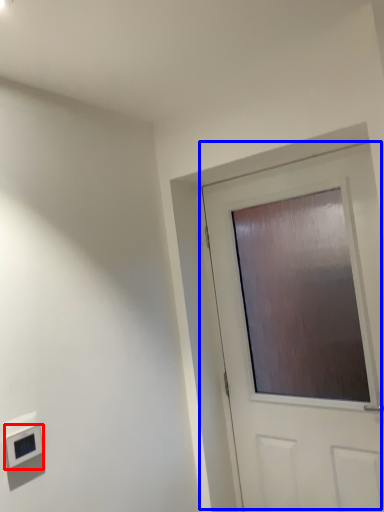
Question: Which of the following is the farthest to the observer, light switch (highlighted by a red box) or door (highlighted by a blue box)?

Choices:
 (A) light switch
 (B) door

Answer: (B)